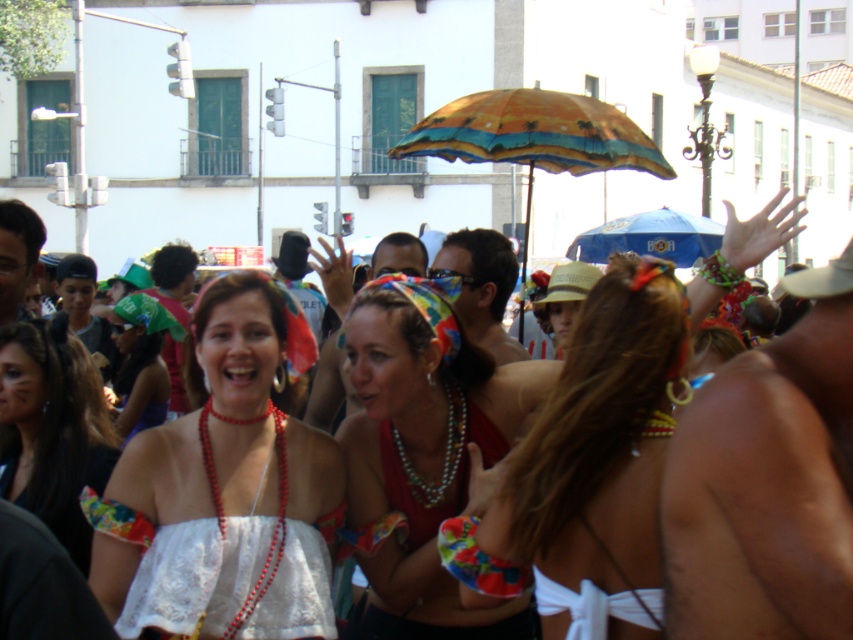
You are a photographer trying to capture the festive scene. You notice two points in the image labeled as point 1 at coordinates point (355,474) and point 2 at coordinates point (717,227). Which point is closer to the camera?

Point (355,474) is closer to the camera than point (717,227).

Based on the photo, you are a photographer trying to capture the central figure in the white lace dress at center and the blue fabric umbrella at upper center in the same frame. Considering their sizes, which object would appear larger in your photo?

The blue fabric umbrella at upper center would appear larger in the photo because it is larger than the white lace dress at center.

You are a photographer trying to capture the central figure in the white lace dress at center and the blue fabric umbrella at upper center. Since you want to ensure both are in focus, you need to know which object is taller. Which one is taller?

The blue fabric umbrella at upper center is taller than the white lace dress at center.